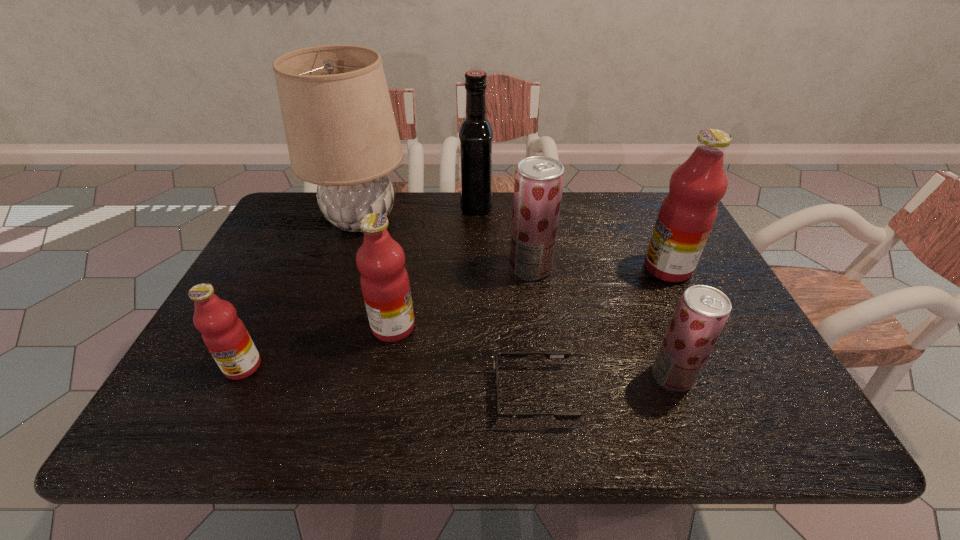
The width and height of the screenshot is (960, 540). What are the coordinates of `object that is positioned at the right edge` in the screenshot? It's located at (687, 214).

You are a GUI agent. You are given a task and a screenshot of the screen. Output one action in this format:
    pyautogui.click(x=<x>, y=<y>)
    Task: Click on the object that is positioned at the far left corner
    Image resolution: width=960 pixels, height=540 pixels.
    Given the screenshot: What is the action you would take?
    pyautogui.click(x=341, y=133)

The width and height of the screenshot is (960, 540). Find the location of `vacant space at the far edge of the desktop`. vacant space at the far edge of the desktop is located at coordinates (412, 205).

The width and height of the screenshot is (960, 540). In the image, there is a desktop. Find the location of `free space at the near edge`. free space at the near edge is located at coordinates (290, 400).

I want to click on free space at the left edge of the desktop, so click(184, 379).

The height and width of the screenshot is (540, 960). I want to click on vacant space at the far left corner of the desktop, so click(x=300, y=230).

This screenshot has width=960, height=540. In the image, there is a desktop. In order to click on free space at the near right corner in this screenshot , I will do `click(774, 421)`.

At what (x,y) coordinates should I click in order to perform the action: click on free area in between the liquor and the rightmost pink fruit juice. Please return your answer as a coordinate pair (x, y). Looking at the image, I should click on (572, 237).

Where is `vacant region between the left strawberry fruit juice and the lampshade`? The image size is (960, 540). vacant region between the left strawberry fruit juice and the lampshade is located at coordinates (445, 244).

Locate an element on the screen. The width and height of the screenshot is (960, 540). free space between the liquor and the sunglasses is located at coordinates (505, 300).